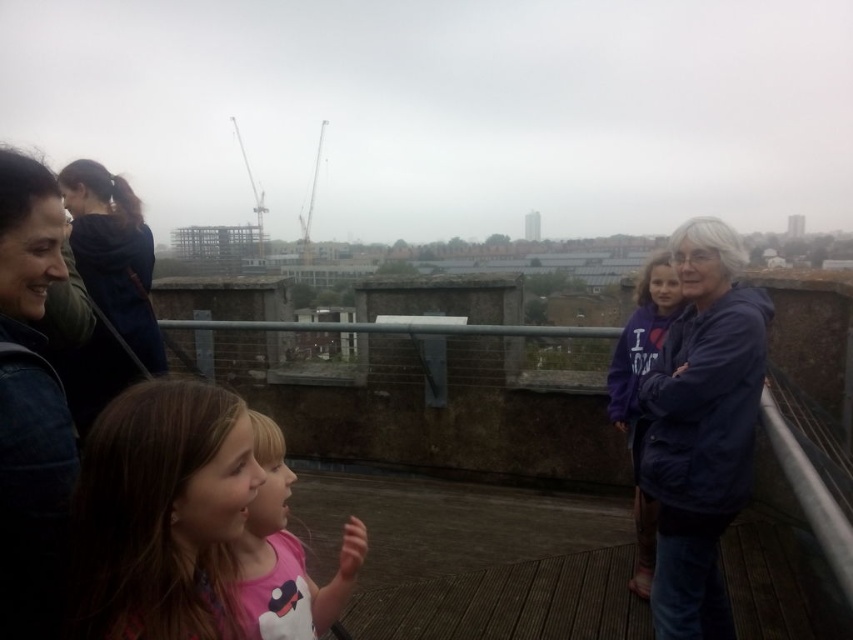
In the scene shown: Does smooth brown hair at lower left have a greater width compared to dark blue denim jacket at left?

Indeed, smooth brown hair at lower left has a greater width compared to dark blue denim jacket at left.

Between smooth brown hair at lower left and dark blue denim jacket at left, which one has less height?

smooth brown hair at lower left

Who is more forward, [216,483] or [57,243]?

Point [216,483] is more forward.

Identify the location of smooth brown hair at lower left. (160, 513).

Is point (59, 412) closer to camera compared to point (100, 253)?

Yes, point (59, 412) is in front of point (100, 253).

Measure the distance from dark blue denim jacket at left to dark blue hoodie at upper left.

A distance of 1.19 meters exists between dark blue denim jacket at left and dark blue hoodie at upper left.

Is point (21, 444) closer to viewer compared to point (71, 412)?

Yes, it is.

Where is `dark blue denim jacket at left`? The width and height of the screenshot is (853, 640). dark blue denim jacket at left is located at coordinates [32, 497].

In the scene shown: Does pink fabric shirt at lower left appear on the left side of purple fleece jacket at right?

Correct, you'll find pink fabric shirt at lower left to the left of purple fleece jacket at right.

Can you confirm if pink fabric shirt at lower left is positioned above purple fleece jacket at right?

Actually, pink fabric shirt at lower left is below purple fleece jacket at right.

Who is more distant from viewer, (219, 563) or (646, 552)?

The point (646, 552) is behind.

At what (x,y) coordinates should I click in order to perform the action: click on pink fabric shirt at lower left. Please return your answer as a coordinate pair (x, y). This screenshot has height=640, width=853. Looking at the image, I should click on pyautogui.click(x=285, y=556).